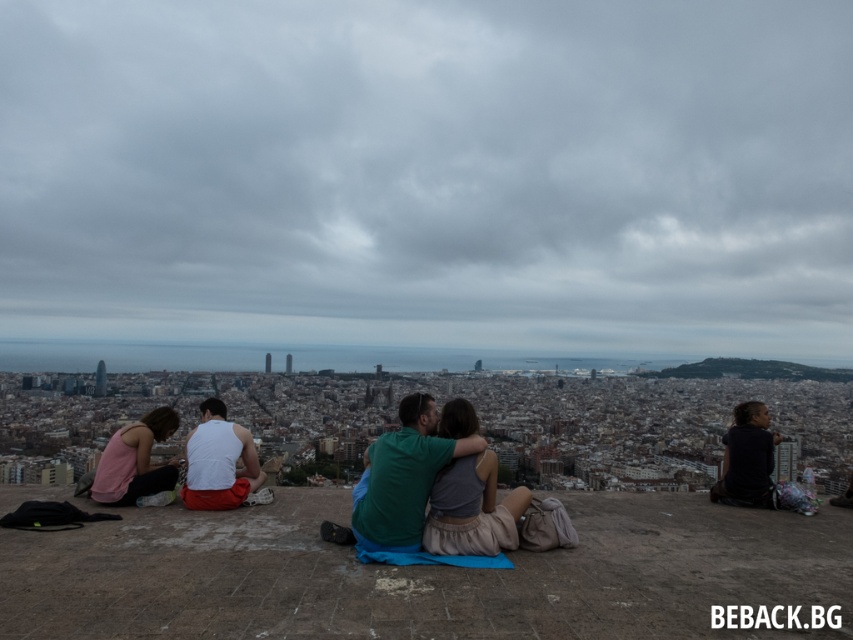
Which is below, white matte tank top at center or pink fabric at left?

pink fabric at left is below.

Is point (202, 454) less distant than point (136, 454)?

Yes, it is.

Is point (200, 484) closer to camera compared to point (97, 484)?

No, (200, 484) is further to viewer.

Identify the location of white matte tank top at center. This screenshot has height=640, width=853. (218, 461).